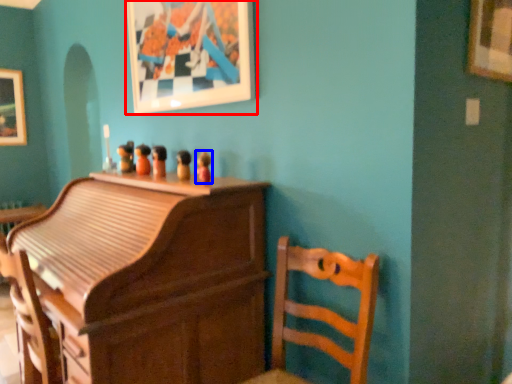
Question: Which of the following is the farthest to the observer, picture frame (highlighted by a red box) or toy (highlighted by a blue box)?

Choices:
 (A) picture frame
 (B) toy

Answer: (B)